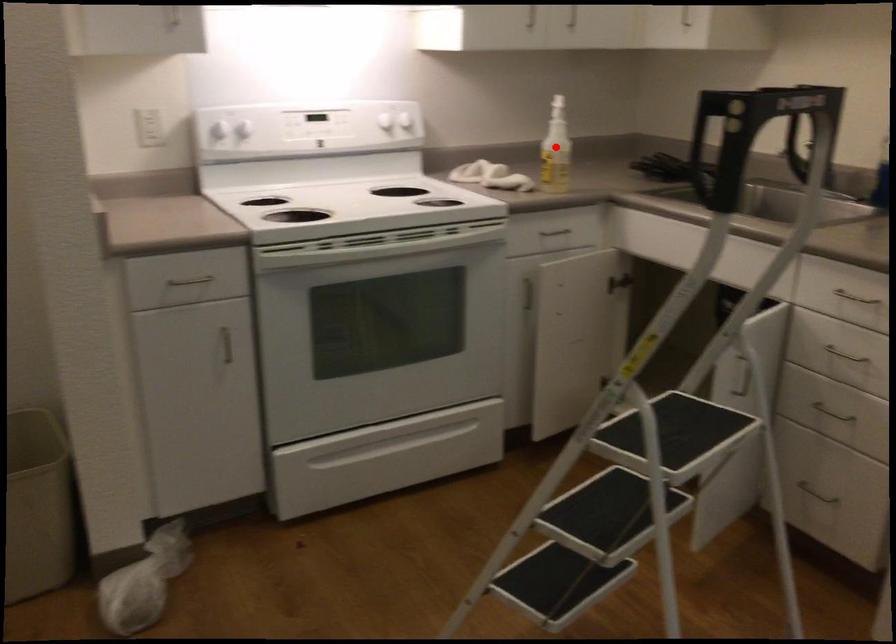
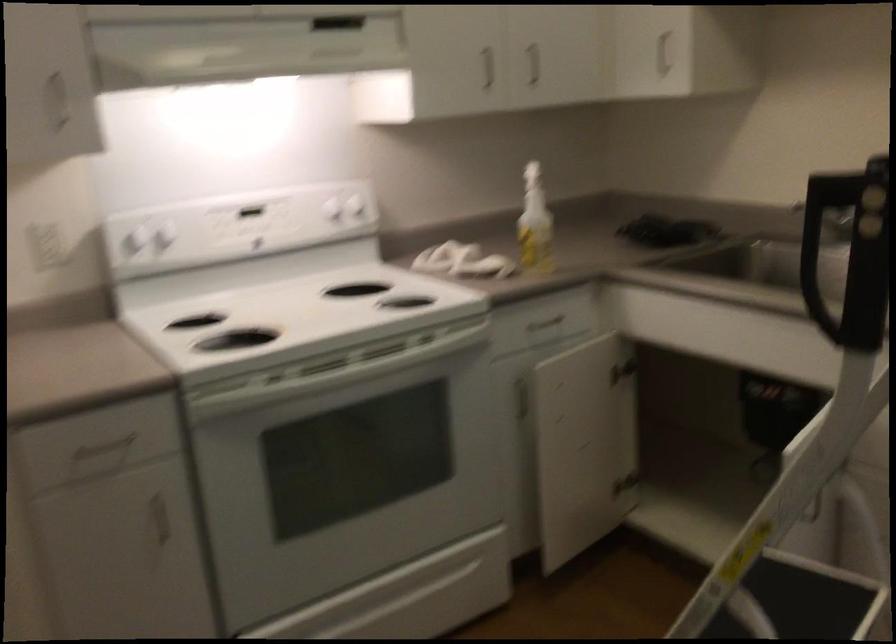
Locate, in the second image, the point that corresponds to the highlighted location in the first image.

(535, 223)